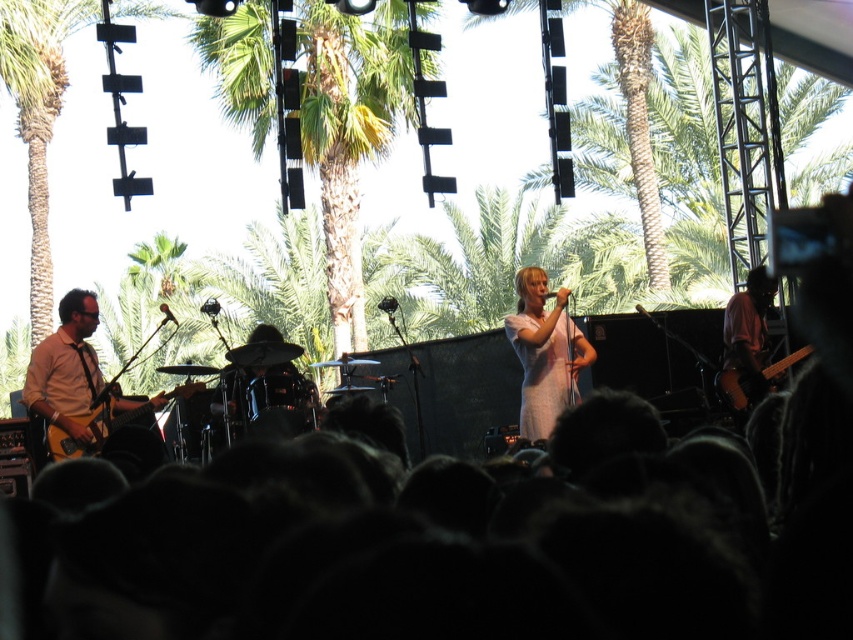
Does black hair at lower center come in front of white cotton dress at center?

That is True.

Based on the photo, between black hair at lower center and white cotton dress at center, which one has less height?

With less height is black hair at lower center.

What do you see at coordinates (432, 548) in the screenshot?
I see `black hair at lower center` at bounding box center [432, 548].

Find the location of a particular element. black hair at lower center is located at coordinates (432, 548).

Is matte brown guitar at left taller than wooden electric guitar at right?

Yes, matte brown guitar at left is taller than wooden electric guitar at right.

Is point (107, 400) farther from viewer compared to point (727, 406)?

No, it is in front of (727, 406).

Which is behind, point (44, 388) or point (746, 376)?

The point (746, 376) is more distant.

Image resolution: width=853 pixels, height=640 pixels. Identify the location of matte brown guitar at left. (76, 381).

What do you see at coordinates (544, 353) in the screenshot?
I see `white cotton dress at center` at bounding box center [544, 353].

Does white cotton dress at center have a greater height compared to matte yellow guitar at left?

Yes.

This screenshot has width=853, height=640. In order to click on white cotton dress at center in this screenshot , I will do `click(544, 353)`.